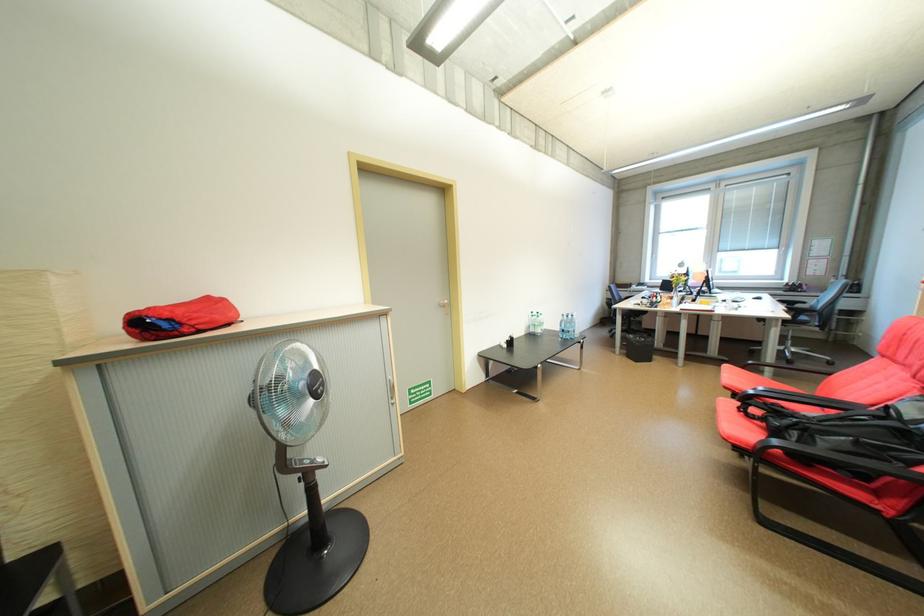
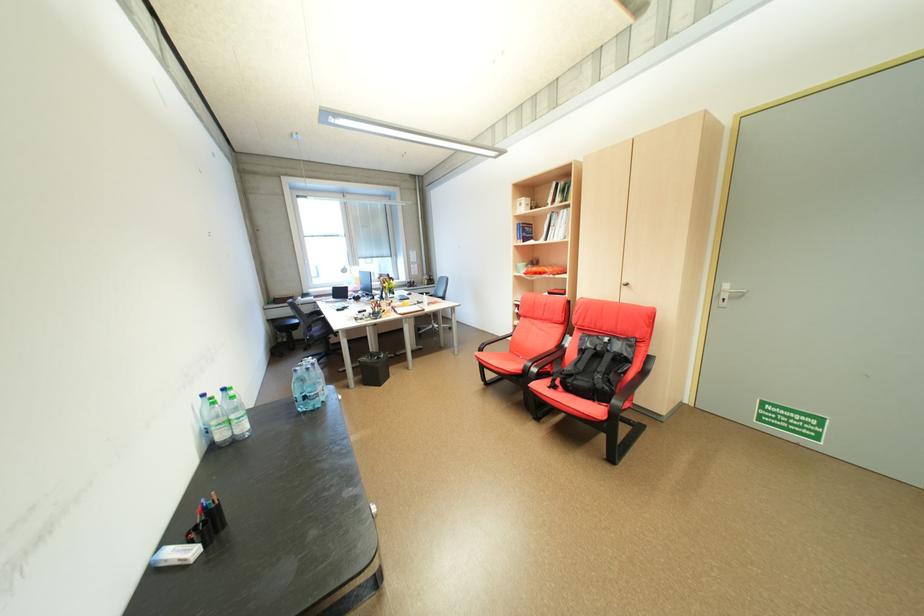
The point at (647, 355) is marked in the first image. Where is the corresponding point in the second image?

(382, 377)